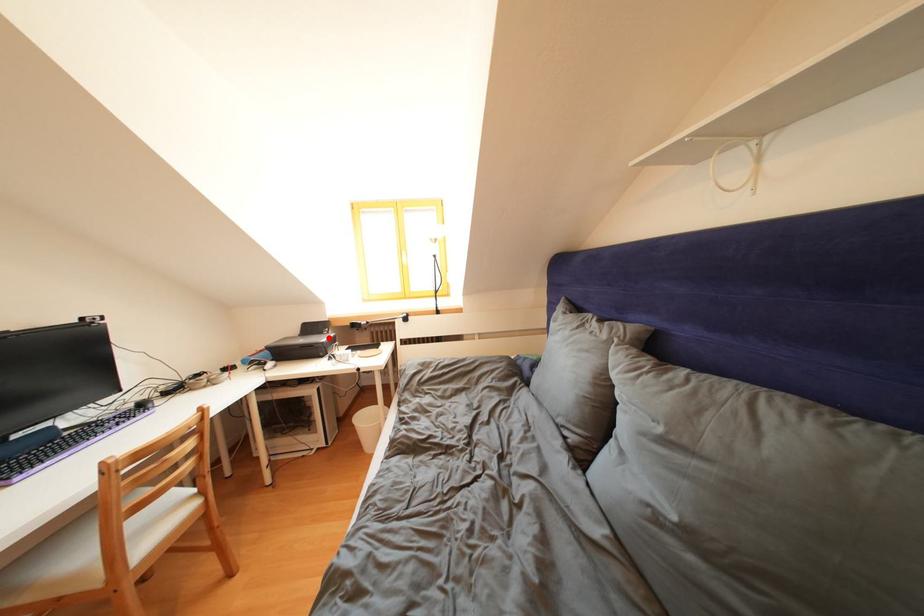
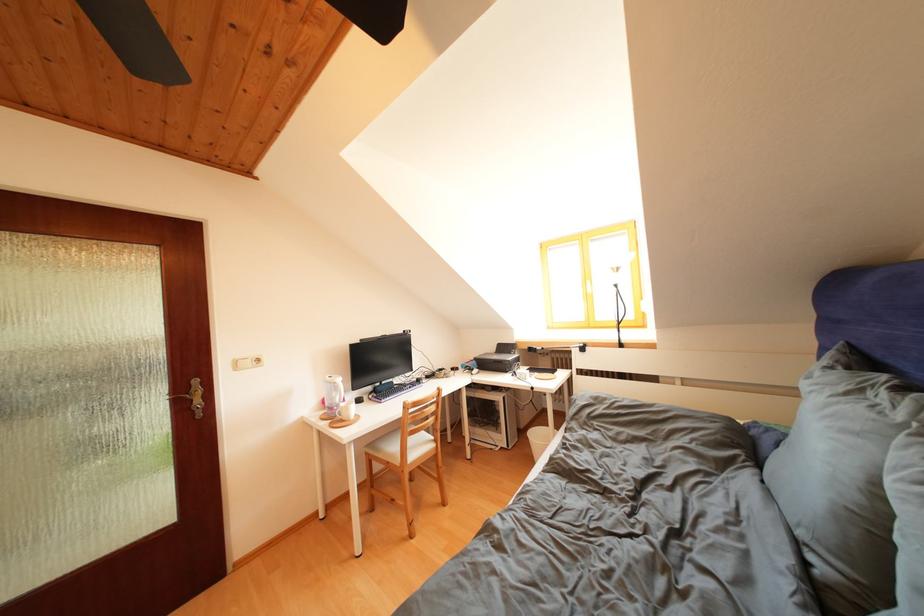
The point at the highlighted location is marked in the first image. Where is the corresponding point in the second image?

(517, 358)